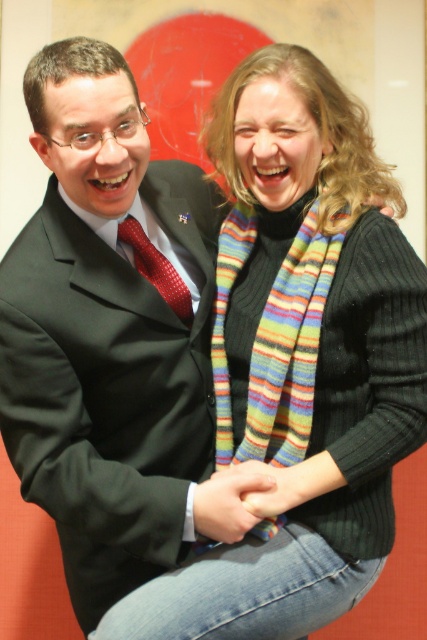
Question: Which point is farther from the camera taking this photo?

Choices:
 (A) (137, 228)
 (B) (327, 243)

Answer: (A)

Question: Is multicolored knitted scarf at center further to camera compared to red silk tie at center?

Choices:
 (A) no
 (B) yes

Answer: (A)

Question: Can you confirm if multicolored knitted scarf at center is smaller than red silk tie at center?

Choices:
 (A) no
 (B) yes

Answer: (A)

Question: Which object is farther from the camera taking this photo?

Choices:
 (A) multicolored knitted scarf at center
 (B) red silk tie at center

Answer: (B)

Question: Is multicolored knitted scarf at center smaller than red silk tie at center?

Choices:
 (A) no
 (B) yes

Answer: (A)